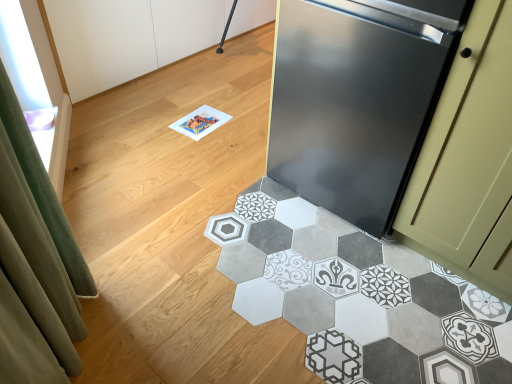
Where is `free spot to the left of stainless steel refrigerator at right`? free spot to the left of stainless steel refrigerator at right is located at coordinates (224, 204).